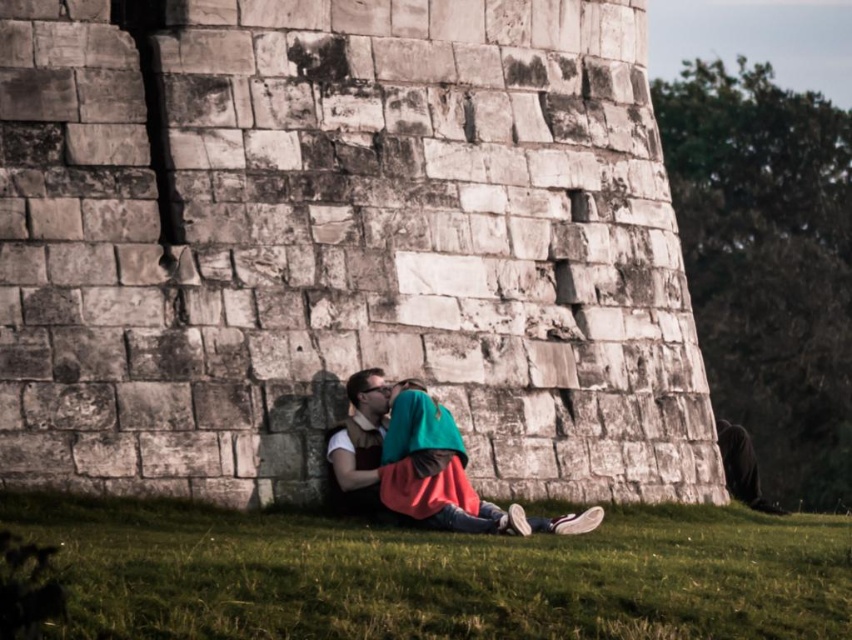
Can you confirm if green grass at lower center is positioned to the right of teal fabric scarf at center?

Indeed, green grass at lower center is positioned on the right side of teal fabric scarf at center.

You are a GUI agent. You are given a task and a screenshot of the screen. Output one action in this format:
    pyautogui.click(x=<x>, y=<y>)
    Task: Click on the green grass at lower center
    The height and width of the screenshot is (640, 852).
    Given the screenshot: What is the action you would take?
    pyautogui.click(x=439, y=573)

Locate an element on the screen. The height and width of the screenshot is (640, 852). green grass at lower center is located at coordinates (439, 573).

Who is shorter, green grass at lower center or matte brown vest at center?

Standing shorter between the two is green grass at lower center.

Does green grass at lower center appear on the left side of matte brown vest at center?

In fact, green grass at lower center is to the right of matte brown vest at center.

Locate an element on the screen. This screenshot has height=640, width=852. green grass at lower center is located at coordinates pyautogui.click(x=439, y=573).

Does teal fabric scarf at center have a lesser height compared to matte brown vest at center?

Yes.

Is point (327, 452) behind point (354, 378)?

No, (327, 452) is closer to viewer.

Where is `teal fabric scarf at center`? This screenshot has height=640, width=852. teal fabric scarf at center is located at coordinates (426, 464).